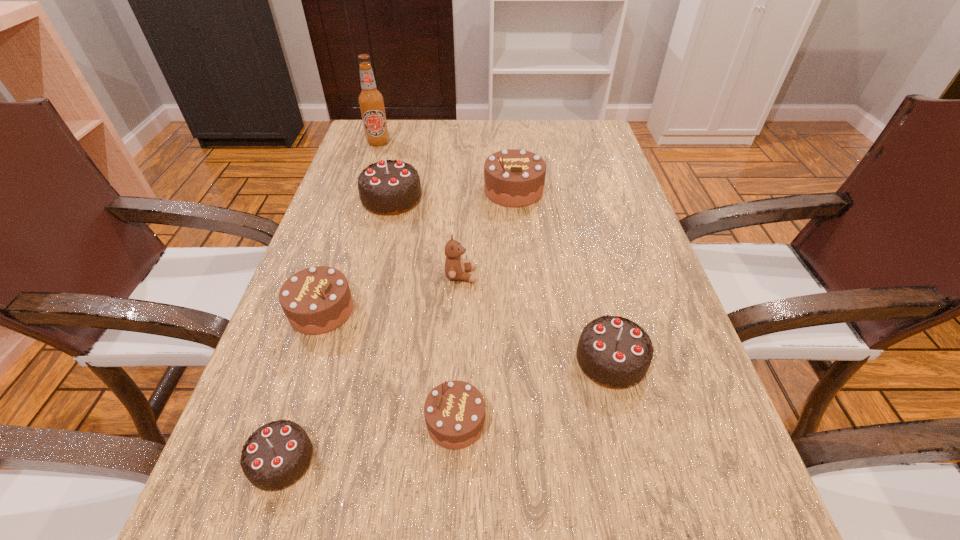
The width and height of the screenshot is (960, 540). Find the location of `the nearest brown chocolate cake`. the nearest brown chocolate cake is located at coordinates (454, 411).

Image resolution: width=960 pixels, height=540 pixels. In order to click on the fourth chocolate cake from left to right in this screenshot , I will do `click(454, 411)`.

Find the location of `the smallest chocolate chocolate cake`. the smallest chocolate chocolate cake is located at coordinates (278, 454).

The width and height of the screenshot is (960, 540). Identify the location of free space located on the front label of the tallest object. (359, 201).

Where is `blank space located on the front of the biggest brown chocolate cake`? This screenshot has width=960, height=540. blank space located on the front of the biggest brown chocolate cake is located at coordinates (519, 253).

Locate an element on the screen. Image resolution: width=960 pixels, height=540 pixels. vacant space located on the right of the biggest chocolate chocolate cake is located at coordinates [443, 198].

I want to click on vacant space located 0.340m on the front-facing side of the teddy bear, so click(x=643, y=275).

Identify the location of vacant space located on the right of the second nearest brown chocolate cake. This screenshot has width=960, height=540. (407, 310).

I want to click on free region located on the back of the second farthest chocolate chocolate cake, so click(575, 214).

Identify the location of free spot located 0.360m on the back of the second brown chocolate cake from left to right. (463, 247).